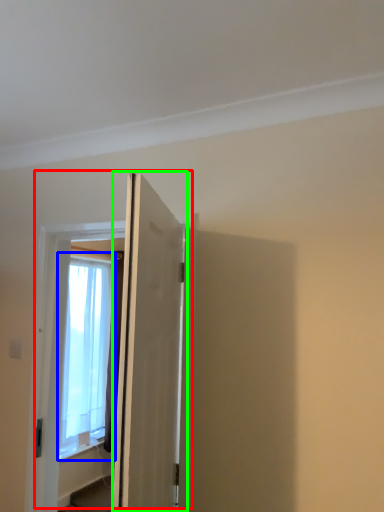
Question: Which object is the closest to the door (highlighted by a red box)? Choose among these: window (highlighted by a blue box) or door (highlighted by a green box).

Choices:
 (A) window
 (B) door

Answer: (B)